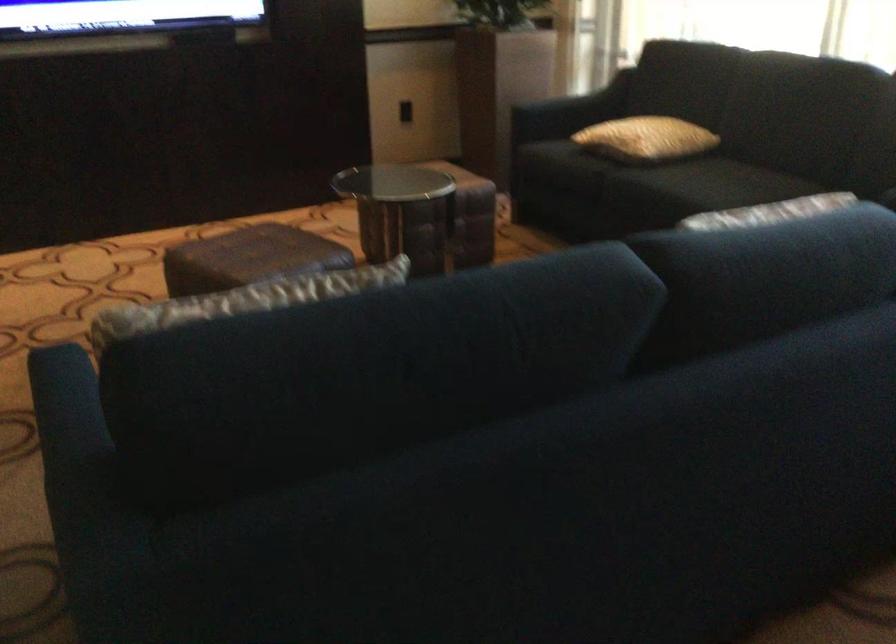
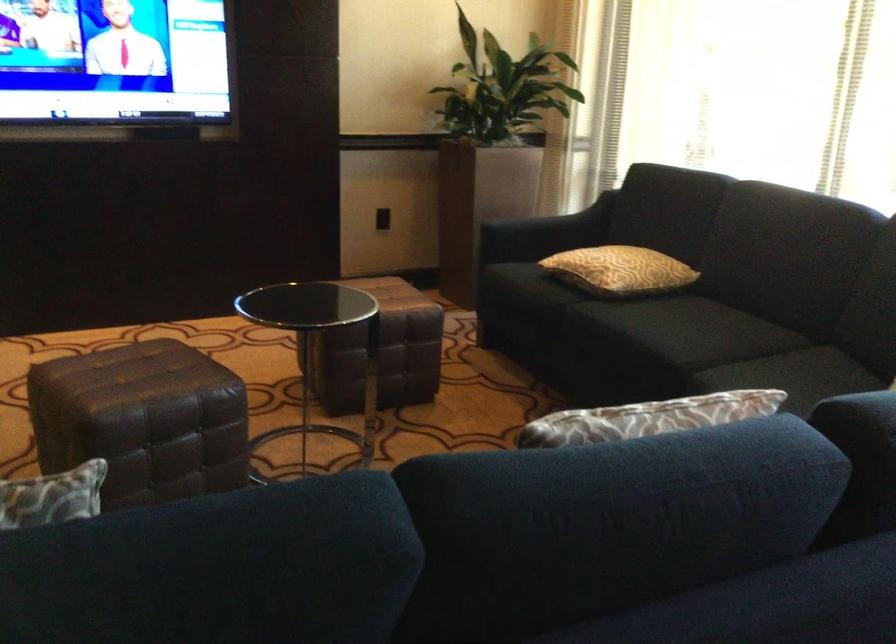
In a continuous first-person perspective shot, in which direction is the camera moving?

The cameraman walked toward right, forward.